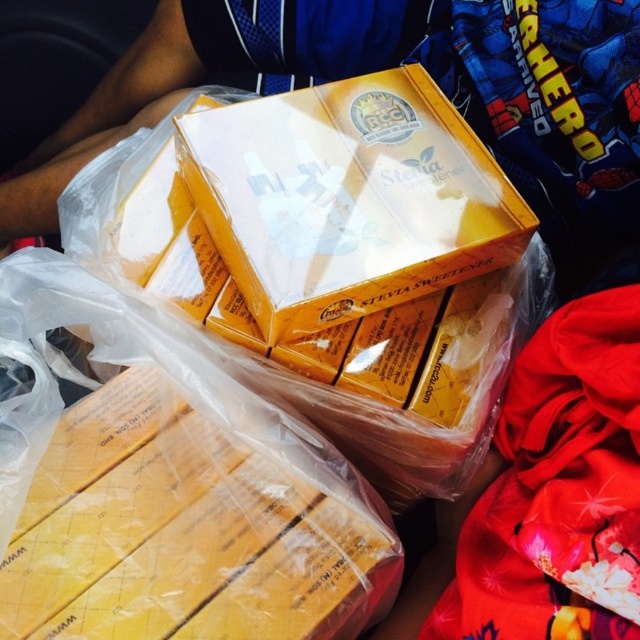
You are holding a camera and want to take a photo of the point at coordinates (113, 508). The camera has a minimum focus distance of 25 inches. Will the point be in focus?

The point at coordinates (113, 508) is 24.23 inches from the camera, which is closer than the minimum focus distance of 25 inches. Therefore, the point will not be in focus.

You are organizing a pantry and see the yellow cardboard box at lower left and the yellow cardboard box at center. Which one is located to the left of the other?

The yellow cardboard box at lower left is positioned on the left side of yellow cardboard box at center.

You are a delivery person who needs to hand over the BCC Stevia Sweetener boxes to a customer. You see the yellow cardboard box at lower left and the yellow cardboard box at center. Which box should you pick up first to ensure you are handling the one closest to you?

The yellow cardboard box at lower left is closer to the viewer, so you should pick up the yellow cardboard box at lower left first.